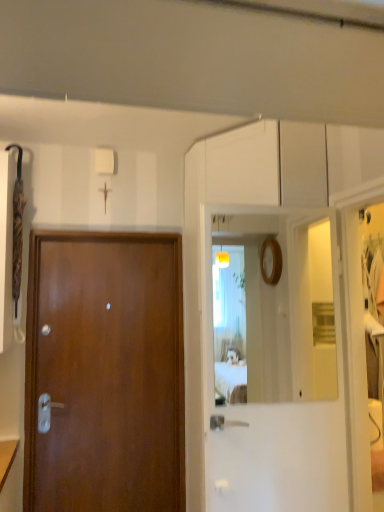
Locate an element on the screen. wooden door at left is located at coordinates (105, 372).

The image size is (384, 512). What do you see at coordinates (105, 372) in the screenshot?
I see `wooden door at left` at bounding box center [105, 372].

In order to click on wooden door at left in this screenshot , I will do `click(105, 372)`.